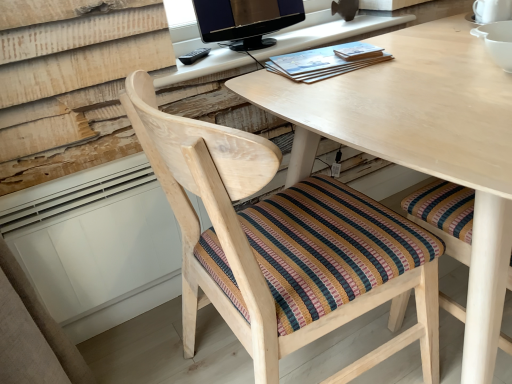
Question: Considering their positions, is natural wood computer desk at center, which ranks as the first computer desk in bottom-to-top order, located in front of or behind blue paperback book at center?

Choices:
 (A) front
 (B) behind

Answer: (A)

Question: Considering the positions of point (475, 105) and point (311, 56), is point (475, 105) closer or farther from the camera than point (311, 56)?

Choices:
 (A) farther
 (B) closer

Answer: (B)

Question: Which of these objects is positioned closest to the natural wood computer desk at center, which ranks as the 2th computer desk in top-to-bottom order?

Choices:
 (A) blue paperback book at center
 (B) matte black monitor at upper center
 (C) matte wooden desk at upper center, arranged as the 1th computer desk when viewed from the top
 (D) natural wood chair at center

Answer: (A)

Question: Which object is positioned farthest from the natural wood chair at center?

Choices:
 (A) natural wood computer desk at center, which ranks as the first computer desk in bottom-to-top order
 (B) matte black monitor at upper center
 (C) matte wooden desk at upper center, arranged as the 1th computer desk when viewed from the top
 (D) blue paperback book at center

Answer: (B)